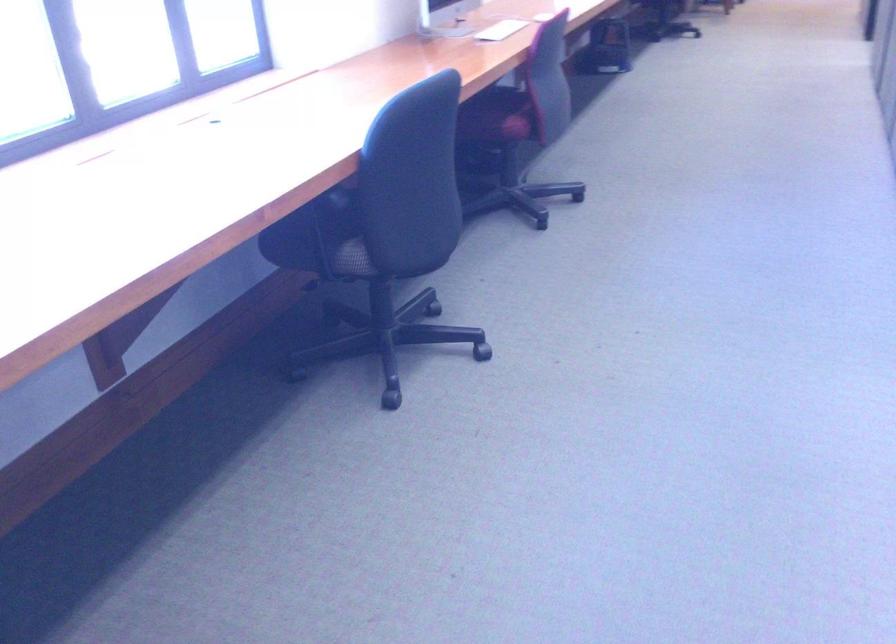
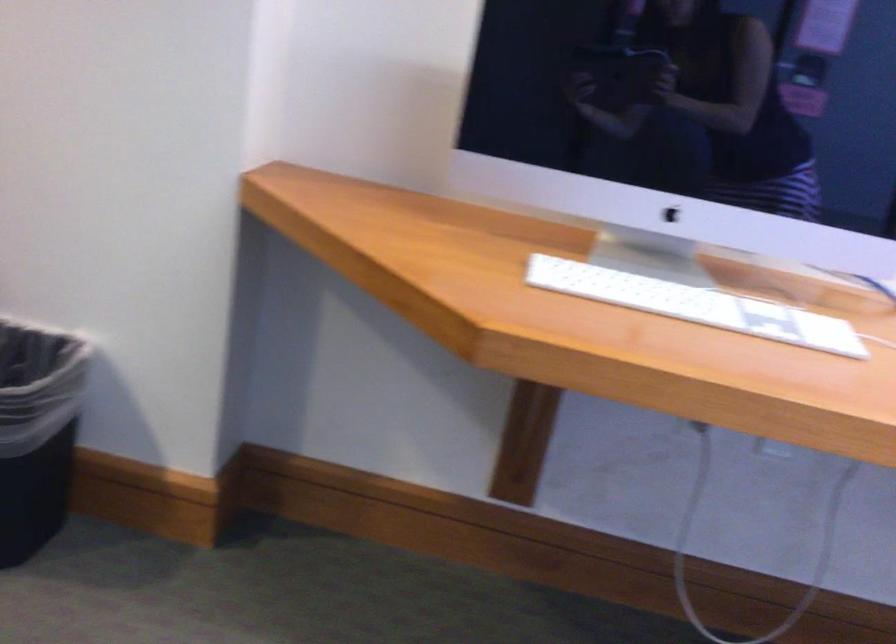
Question: Based on the continuous images, in which direction is the camera rotating? Reply with the corresponding letter.

Choices:
 (A) Left
 (B) Right
 (C) Up
 (D) Down

Answer: (A)